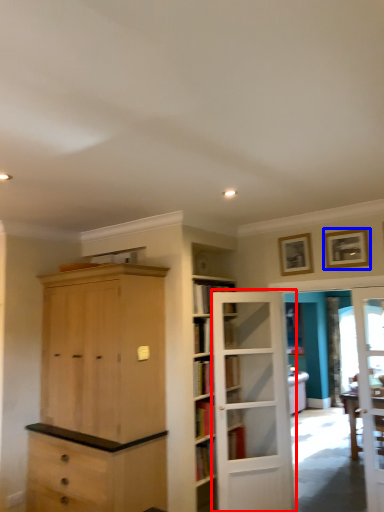
Question: Which object is further to the camera taking this photo, door (highlighted by a red box) or picture frame (highlighted by a blue box)?

Choices:
 (A) door
 (B) picture frame

Answer: (B)